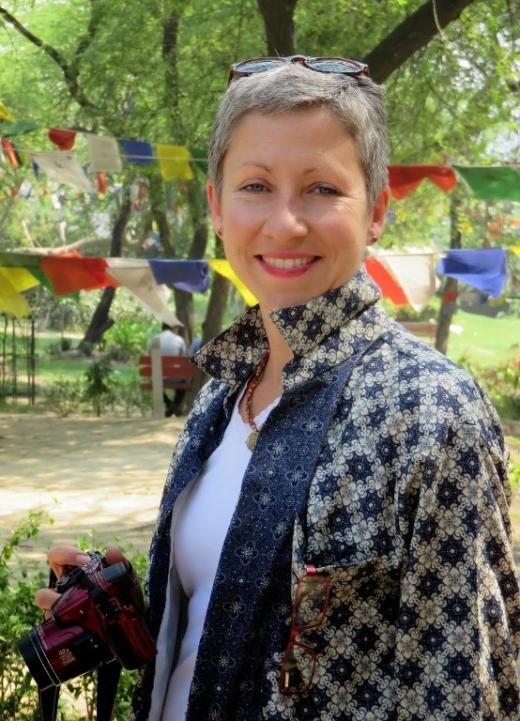
You are a GUI agent. You are given a task and a screenshot of the screen. Output one action in this format:
    pyautogui.click(x=<x>, y=<y>)
    Task: Click on the bench
    Image resolution: width=520 pixels, height=721 pixels.
    Given the screenshot: What is the action you would take?
    pyautogui.click(x=166, y=378)